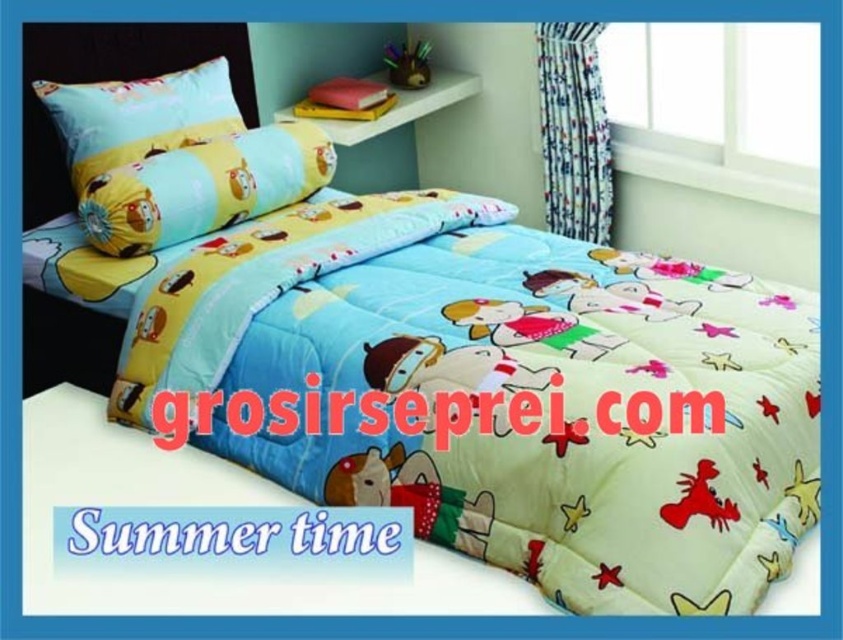
Question: Does yellow fabric pillow at upper left appear under light blue fabric pillow at upper left?

Choices:
 (A) no
 (B) yes

Answer: (B)

Question: Which point appears closest to the camera in this image?

Choices:
 (A) (100, 248)
 (B) (143, 157)

Answer: (A)

Question: Is yellow fabric pillow at upper left below light blue fabric pillow at upper left?

Choices:
 (A) no
 (B) yes

Answer: (B)

Question: Which object appears closest to the camera in this image?

Choices:
 (A) yellow fabric pillow at upper left
 (B) light blue fabric pillow at upper left

Answer: (A)

Question: Is yellow fabric pillow at upper left further to camera compared to light blue fabric pillow at upper left?

Choices:
 (A) no
 (B) yes

Answer: (A)

Question: Which point is farther from the camera taking this photo?

Choices:
 (A) (78, 172)
 (B) (106, 195)

Answer: (A)